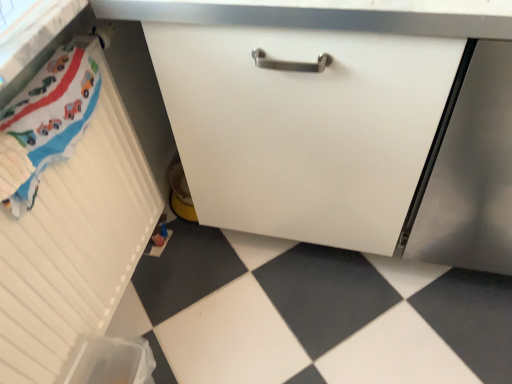
You are a GUI agent. You are given a task and a screenshot of the screen. Output one action in this format:
    pyautogui.click(x=<x>, y=<y>)
    Task: Click on the free space below white matte radiator at left, which is the first cabinetry from left to right (from a real-world perspective)
    This screenshot has width=512, height=384.
    Given the screenshot: What is the action you would take?
    pyautogui.click(x=138, y=285)